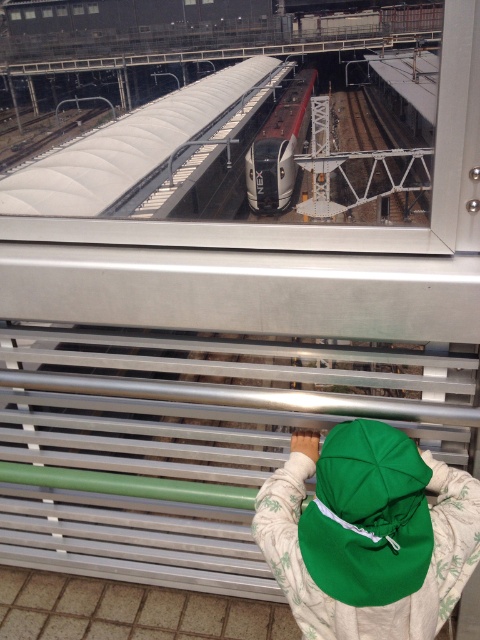
Question: From the image, what is the correct spatial relationship of green fabric cap at lower center in relation to silver metallic train at center?

Choices:
 (A) left
 (B) right

Answer: (A)

Question: Which point is farther to the camera?

Choices:
 (A) (301, 528)
 (B) (263, 211)

Answer: (B)

Question: Can you confirm if green fabric cap at lower center is positioned above silver metallic train at center?

Choices:
 (A) no
 (B) yes

Answer: (A)

Question: Is green fabric cap at lower center positioned in front of silver metallic train at center?

Choices:
 (A) no
 (B) yes

Answer: (B)

Question: Which point appears farthest from the camera in this image?

Choices:
 (A) (288, 195)
 (B) (430, 573)

Answer: (A)